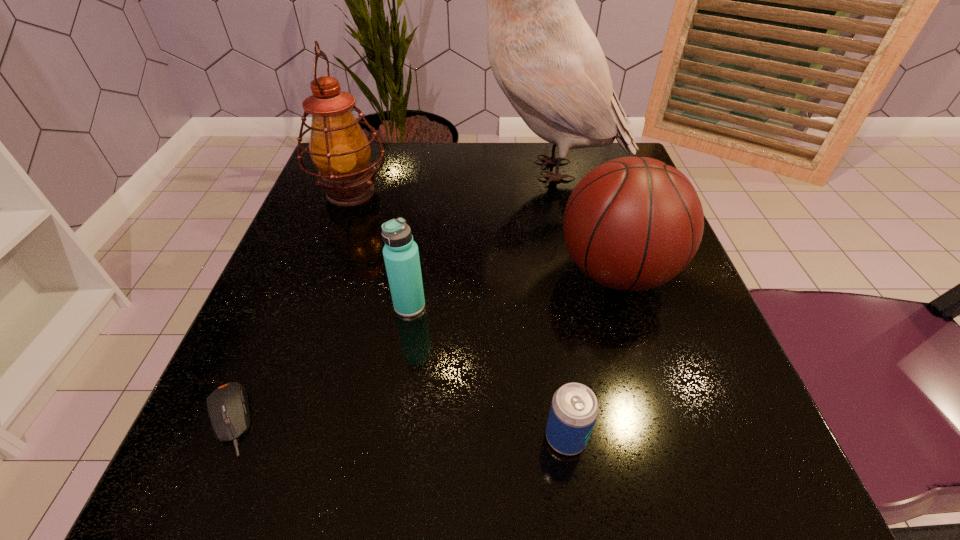
This screenshot has width=960, height=540. In the image, there is a desktop. What are the coordinates of `vacant space at the far left corner` in the screenshot? It's located at (383, 171).

In the image, there is a desktop. Find the location of `free space at the near left corner`. free space at the near left corner is located at coordinates (243, 505).

Locate an element on the screen. The height and width of the screenshot is (540, 960). vacant space at the far right corner of the desktop is located at coordinates (606, 151).

In the image, there is a desktop. In order to click on free space at the near right corner in this screenshot , I will do `click(750, 469)`.

Where is `free space between the computer mouse and the third tallest object`? The image size is (960, 540). free space between the computer mouse and the third tallest object is located at coordinates (422, 345).

You are a GUI agent. You are given a task and a screenshot of the screen. Output one action in this format:
    pyautogui.click(x=<x>, y=<y>)
    Task: Click on the free space between the fifth tallest object and the second tallest object
    The height and width of the screenshot is (540, 960).
    Given the screenshot: What is the action you would take?
    pyautogui.click(x=458, y=315)

Identify the location of free space between the fifth tallest object and the tallest object. (557, 303).

Where is `vacant space that is in between the beer can and the shortest object`? The width and height of the screenshot is (960, 540). vacant space that is in between the beer can and the shortest object is located at coordinates (397, 428).

The width and height of the screenshot is (960, 540). I want to click on vacant area that lies between the fifth tallest object and the fifth shortest object, so click(458, 315).

Identify the location of free space between the second tallest object and the computer mouse. This screenshot has width=960, height=540. (290, 306).